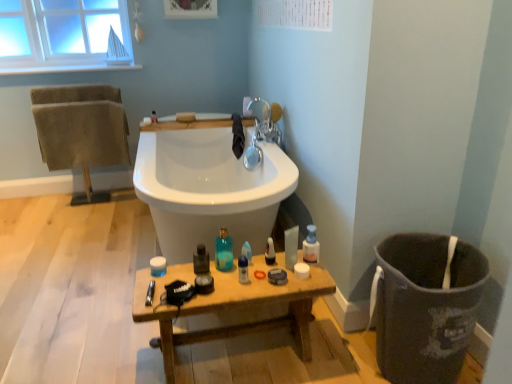
Find the location of a particular element. Image resolution: width=512 pixels, height=384 pixels. translucent plastic bottle at center, the 4th toiletry positioned from the left is located at coordinates (311, 246).

What is the approximate width of brown textured towels at left, which is the first bath towel in left-to-right order?

brown textured towels at left, which is the first bath towel in left-to-right order, is 11.33 inches wide.

Locate an element on the screen. Image resolution: width=512 pixels, height=384 pixels. translucent plastic spray bottle at center, which is the 1th cleaning product from right to left is located at coordinates (270, 252).

Locate an element on the screen. This screenshot has height=384, width=512. translucent plastic bottle at center, which appears as the 1th toiletry when viewed from the right is located at coordinates (311, 246).

From a real-world perspective, is translucent plastic container at center, the 3th toiletry in the back-to-front sequence, physically above translucent plastic spray bottle at center, which is the 1th cleaning product from right to left?

No, from a real-world perspective, translucent plastic container at center, the 3th toiletry in the back-to-front sequence, is not over translucent plastic spray bottle at center, which is the 1th cleaning product from right to left

Is translucent plastic container at center, the 2th toiletry when ordered from front to back, facing away from translucent plastic spray bottle at center, arranged as the 2th cleaning product when viewed from the left?

That's right, translucent plastic container at center, the 2th toiletry when ordered from front to back, is facing away from translucent plastic spray bottle at center, arranged as the 2th cleaning product when viewed from the left.

Is translucent plastic container at center, which is the third toiletry in right-to-left order, located outside translucent plastic spray bottle at center, arranged as the 2th cleaning product when viewed from the left?

Yes, translucent plastic container at center, which is the third toiletry in right-to-left order, is outside of translucent plastic spray bottle at center, arranged as the 2th cleaning product when viewed from the left.

Does translucent plastic container at center, the 3th toiletry in the back-to-front sequence, have a smaller size compared to translucent plastic spray bottle at center, arranged as the 2th cleaning product when viewed from the left?

No, translucent plastic container at center, the 3th toiletry in the back-to-front sequence, is not smaller than translucent plastic spray bottle at center, arranged as the 2th cleaning product when viewed from the left.

Is brown textured towels at left, the 2th bath towel from the right, bigger or smaller than blue glossy bottle at center, which is the 1th mouthwash in right-to-left order?

Clearly, brown textured towels at left, the 2th bath towel from the right, is larger in size than blue glossy bottle at center, which is the 1th mouthwash in right-to-left order.

What's the angular difference between brown textured towels at left, which is the first bath towel in left-to-right order, and blue glossy bottle at center, which is the 1th mouthwash in right-to-left order,'s facing directions?

There is a 92.3-degree angle between the facing directions of brown textured towels at left, which is the first bath towel in left-to-right order, and blue glossy bottle at center, which is the 1th mouthwash in right-to-left order.

From a real-world perspective, is brown textured towels at left, the 2th bath towel from the right, positioned above or below blue glossy bottle at center, which is the 1th mouthwash in right-to-left order?

brown textured towels at left, the 2th bath towel from the right, is situated higher than blue glossy bottle at center, which is the 1th mouthwash in right-to-left order, in the real world.

Is brown textured towels at left, the 2th bath towel from the right, touching blue glossy bottle at center, which is the 1th mouthwash in right-to-left order?

No, brown textured towels at left, the 2th bath towel from the right, is not in contact with blue glossy bottle at center, which is the 1th mouthwash in right-to-left order.

Which is in front, translucent plastic spray bottle at center, arranged as the 2th cleaning product when viewed from the left, or translucent plastic bottle at center, which is the 2th toiletry in back-to-front order?

translucent plastic bottle at center, which is the 2th toiletry in back-to-front order.

Looking at this image, which of these two, translucent plastic spray bottle at center, which is the 1th cleaning product from right to left, or translucent plastic bottle at center, the 4th toiletry positioned from the left, is thinner?

Thinner between the two is translucent plastic bottle at center, the 4th toiletry positioned from the left.

Can you confirm if translucent plastic spray bottle at center, arranged as the 2th cleaning product when viewed from the left, is positioned to the right of translucent plastic bottle at center, the 4th toiletry positioned from the left?

In fact, translucent plastic spray bottle at center, arranged as the 2th cleaning product when viewed from the left, is to the left of translucent plastic bottle at center, the 4th toiletry positioned from the left.

Is blue glossy bottle at center, the 2th mouthwash in the left-to-right sequence, touching black cloth at upper center, which appears as the second bath towel when viewed from the left?

No.

Can you confirm if blue glossy bottle at center, which is the 1th mouthwash in right-to-left order, is bigger than black cloth at upper center, which is counted as the 1th bath towel, starting from the right?

No, blue glossy bottle at center, which is the 1th mouthwash in right-to-left order, is not bigger than black cloth at upper center, which is counted as the 1th bath towel, starting from the right.

There is a black cloth at upper center, which appears as the second bath towel when viewed from the left. In order to click on the 2nd mouthwash below it (from a real-world perspective) in this screenshot , I will do `click(243, 270)`.

Considering their positions, is black cloth at upper center, which appears as the second bath towel when viewed from the left, located in front of or behind blue glossy bottle at center, the 2th mouthwash in the left-to-right sequence?

Clearly, black cloth at upper center, which appears as the second bath towel when viewed from the left, is behind blue glossy bottle at center, the 2th mouthwash in the left-to-right sequence.

Does black cloth at upper center, which is counted as the 1th bath towel, starting from the right, appear on the left side of blue glossy bottle at center, the 2th mouthwash in the left-to-right sequence?

Yes.

From a real-world perspective, which object rests below the other?

blue glossy bottle at center, the 2th mouthwash in the left-to-right sequence.

Which bath towel is the 1st one when counting from the back of the blue glossy bottle at center, which is the 1th mouthwash in right-to-left order? Please provide its 2D coordinates.

[(237, 136)]

From the image's perspective, is black cloth at upper center, which is counted as the 1th bath towel, starting from the right, positioned above or below wooden table at lower center?

Based on their image positions, black cloth at upper center, which is counted as the 1th bath towel, starting from the right, is located above wooden table at lower center.

Is black cloth at upper center, which is counted as the 1th bath towel, starting from the right, positioned with its back to wooden table at lower center?

No, black cloth at upper center, which is counted as the 1th bath towel, starting from the right,'s orientation is not away from wooden table at lower center.

Based on their positions, is black cloth at upper center, which is counted as the 1th bath towel, starting from the right, located to the left or right of wooden table at lower center?

Based on their positions, black cloth at upper center, which is counted as the 1th bath towel, starting from the right, is located to the left of wooden table at lower center.

You are a GUI agent. You are given a task and a screenshot of the screen. Output one action in this format:
    pyautogui.click(x=<x>, y=<y>)
    Task: Click on the table below the black cloth at upper center, which is counted as the 1th bath towel, starting from the right (from the image's perspective)
    Image resolution: width=512 pixels, height=384 pixels.
    Given the screenshot: What is the action you would take?
    pyautogui.click(x=231, y=306)

Considering the sizes of objects translucent plastic bottle at center, the 4th toiletry positioned from the left, and translucent plastic spray bottle at center, the 1th cleaning product when ordered from left to right, in the image provided, who is thinner, translucent plastic bottle at center, the 4th toiletry positioned from the left, or translucent plastic spray bottle at center, the 1th cleaning product when ordered from left to right,?

translucent plastic spray bottle at center, the 1th cleaning product when ordered from left to right.

Considering the sizes of objects translucent plastic bottle at center, the 4th toiletry positioned from the left, and translucent plastic spray bottle at center, the 1th cleaning product when ordered from left to right, in the image provided, who is smaller, translucent plastic bottle at center, the 4th toiletry positioned from the left, or translucent plastic spray bottle at center, the 1th cleaning product when ordered from left to right,?

With smaller size is translucent plastic spray bottle at center, the 1th cleaning product when ordered from left to right.

Is translucent plastic bottle at center, which appears as the 3th toiletry when ordered from the bottom, to the left of translucent plastic spray bottle at center, the 1th cleaning product when ordered from left to right, from the viewer's perspective?

Incorrect, translucent plastic bottle at center, which appears as the 3th toiletry when ordered from the bottom, is not on the left side of translucent plastic spray bottle at center, the 1th cleaning product when ordered from left to right.

Considering the sizes of objects translucent plastic bottle at center, which appears as the third toiletry when viewed from the front, and translucent plastic spray bottle at center, the 1th cleaning product when ordered from left to right, in the image provided, who is taller, translucent plastic bottle at center, which appears as the third toiletry when viewed from the front, or translucent plastic spray bottle at center, the 1th cleaning product when ordered from left to right,?

Standing taller between the two is translucent plastic bottle at center, which appears as the third toiletry when viewed from the front.

From the image's perspective, count 2nd cleaning products upward from the translucent plastic container at center, which is the third toiletry in right-to-left order, and point to it. Please provide its 2D coordinates.

[(270, 252)]

Where is `mouthwash that is the 2nd object located below the brown textured towels at left, the 2th bath towel from the right (from the image's perspective)`? The width and height of the screenshot is (512, 384). mouthwash that is the 2nd object located below the brown textured towels at left, the 2th bath towel from the right (from the image's perspective) is located at coordinates (243, 270).

Estimate the real-world distances between objects in this image. Which object is further from translucent glass mouthwash at center, placed as the second mouthwash when sorted from right to left, wooden table at lower center or silver metallic faucet at upper center?

silver metallic faucet at upper center is further to translucent glass mouthwash at center, placed as the second mouthwash when sorted from right to left.

Looking at this image, from the image, which object appears to be nearer to wooden table at lower center, translucent plastic spray bottle at center, arranged as the 2th cleaning product when viewed from the left, or translucent plastic soap at upper center, which appears as the fourth toiletry when viewed from the front?

The object closer to wooden table at lower center is translucent plastic spray bottle at center, arranged as the 2th cleaning product when viewed from the left.

Looking at the image, which one is located further to black cloth at upper center, which is counted as the 1th bath towel, starting from the right, translucent blue glass bottle at center, which is counted as the 4th toiletry, starting from the back, or blue glossy bottle at center, which is the 1th mouthwash in right-to-left order?

Among the two, blue glossy bottle at center, which is the 1th mouthwash in right-to-left order, is located further to black cloth at upper center, which is counted as the 1th bath towel, starting from the right.

Looking at the image, which one is located further to translucent blue glass bottle at center, the first toiletry from the front, silver metallic faucet at upper center or wooden table at lower center?

Based on the image, silver metallic faucet at upper center appears to be further to translucent blue glass bottle at center, the first toiletry from the front.

Which object lies nearer to the anchor point translucent plastic spray bottle at center, the 1th cleaning product when ordered from left to right, translucent blue glass bottle at center, which is counted as the 3th toiletry, starting from the top, or brown textured towels at left, which is the first bath towel in left-to-right order?

translucent blue glass bottle at center, which is counted as the 3th toiletry, starting from the top.

Looking at the image, which one is located closer to silver metallic faucet at upper center, translucent plastic spray bottle at center, arranged as the 2th cleaning product when viewed from the left, or translucent plastic spray bottle at center, the 1th cleaning product when ordered from left to right?

translucent plastic spray bottle at center, the 1th cleaning product when ordered from left to right, is positioned closer to the anchor silver metallic faucet at upper center.

From the image, which object appears to be farther from blue glossy bottle at center, the 2th mouthwash in the left-to-right sequence, translucent glass mouthwash at center, placed as the second mouthwash when sorted from right to left, or wooden table at lower center?

wooden table at lower center.

From the image, which object appears to be nearer to silver metallic faucet at upper center, blue glossy bottle at center, which is the 1th mouthwash in right-to-left order, or translucent plastic spray bottle at center, arranged as the 2th cleaning product when viewed from the left?

translucent plastic spray bottle at center, arranged as the 2th cleaning product when viewed from the left, is positioned closer to the anchor silver metallic faucet at upper center.

Where is `bath towel situated between brown textured towels at left, which is the first bath towel in left-to-right order, and translucent plastic bottle at center, which appears as the 3th toiletry when ordered from the bottom, from left to right`? bath towel situated between brown textured towels at left, which is the first bath towel in left-to-right order, and translucent plastic bottle at center, which appears as the 3th toiletry when ordered from the bottom, from left to right is located at coordinates (237, 136).

Locate an element on the screen. The width and height of the screenshot is (512, 384). tap positioned between translucent plastic container at center, the 3th toiletry in the back-to-front sequence, and translucent plastic soap at upper center, the first toiletry positioned from the back, from near to far is located at coordinates 263,131.

This screenshot has height=384, width=512. What are the coordinates of `toiletry located between translucent glass mouthwash at center, placed as the second mouthwash when sorted from right to left, and blue glossy bottle at center, the 2th mouthwash in the left-to-right sequence, in the left-right direction` in the screenshot? It's located at (224, 251).

This screenshot has height=384, width=512. I want to click on cleaning product between translucent glass mouthwash at center, which is counted as the first mouthwash, starting from the left, and translucent plastic spray bottle at center, arranged as the 2th cleaning product when viewed from the left, so click(x=247, y=252).